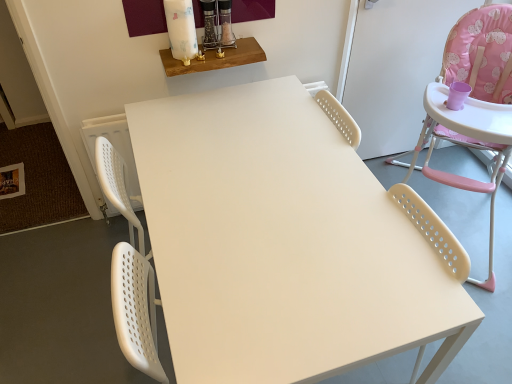
Question: Is wooden shelf at upper center, positioned as the 2th table in front-to-back order, positioned with its back to pink fabric highchair at right?

Choices:
 (A) yes
 (B) no

Answer: (B)

Question: Can you confirm if wooden shelf at upper center, which is counted as the 1th table, starting from the top, is smaller than pink fabric highchair at right?

Choices:
 (A) yes
 (B) no

Answer: (A)

Question: Is wooden shelf at upper center, which is the 2th table from right to left, taller than pink fabric highchair at right?

Choices:
 (A) no
 (B) yes

Answer: (A)

Question: From a real-world perspective, is wooden shelf at upper center, which is the 2th table from right to left, beneath pink fabric highchair at right?

Choices:
 (A) yes
 (B) no

Answer: (B)

Question: Is wooden shelf at upper center, the first table in the left-to-right sequence, in contact with pink fabric highchair at right?

Choices:
 (A) no
 (B) yes

Answer: (A)

Question: In terms of height, does matte white table at center, marked as the first table in a right-to-left arrangement, look taller or shorter compared to pink fabric highchair at right?

Choices:
 (A) short
 (B) tall

Answer: (A)

Question: Looking at the image, does matte white table at center, which is counted as the 1th table, starting from the bottom, seem bigger or smaller compared to pink fabric highchair at right?

Choices:
 (A) big
 (B) small

Answer: (B)

Question: Is matte white table at center, marked as the first table in a right-to-left arrangement, in front of or behind pink fabric highchair at right in the image?

Choices:
 (A) behind
 (B) front

Answer: (B)

Question: Does point (257, 107) appear closer or farther from the camera than point (428, 107)?

Choices:
 (A) closer
 (B) farther

Answer: (A)

Question: Visually, is wooden shelf at upper center, arranged as the second table when ordered from the bottom, positioned to the left or to the right of pink fabric highchair at right?

Choices:
 (A) right
 (B) left

Answer: (B)

Question: From the image's perspective, relative to pink fabric highchair at right, is wooden shelf at upper center, the first table in the left-to-right sequence, above or below?

Choices:
 (A) below
 (B) above

Answer: (B)

Question: Considering the positions of wooden shelf at upper center, arranged as the second table when ordered from the bottom, and pink fabric highchair at right in the image, is wooden shelf at upper center, arranged as the second table when ordered from the bottom, wider or thinner than pink fabric highchair at right?

Choices:
 (A) wide
 (B) thin

Answer: (B)

Question: Considering their positions, is wooden shelf at upper center, arranged as the second table when ordered from the bottom, located in front of or behind pink fabric highchair at right?

Choices:
 (A) front
 (B) behind

Answer: (B)

Question: Is pink fabric highchair at right situated inside matte white table at center, marked as the first table in a right-to-left arrangement, or outside?

Choices:
 (A) inside
 (B) outside

Answer: (B)

Question: From a real-world perspective, relative to matte white table at center, which is counted as the second table, starting from the left, is pink fabric highchair at right vertically above or below?

Choices:
 (A) below
 (B) above

Answer: (B)